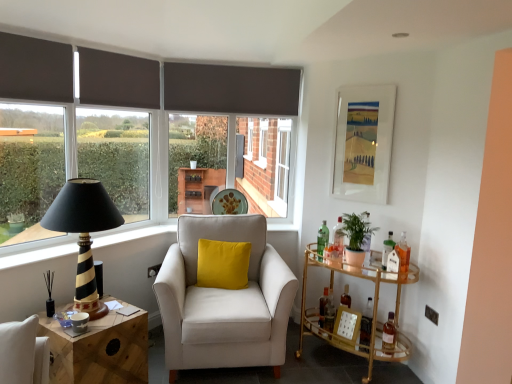
The height and width of the screenshot is (384, 512). I want to click on free location above dark grey fabric curtain at upper center, which ranks as the 2th curtain in left-to-right order (from a real-world perspective), so click(122, 51).